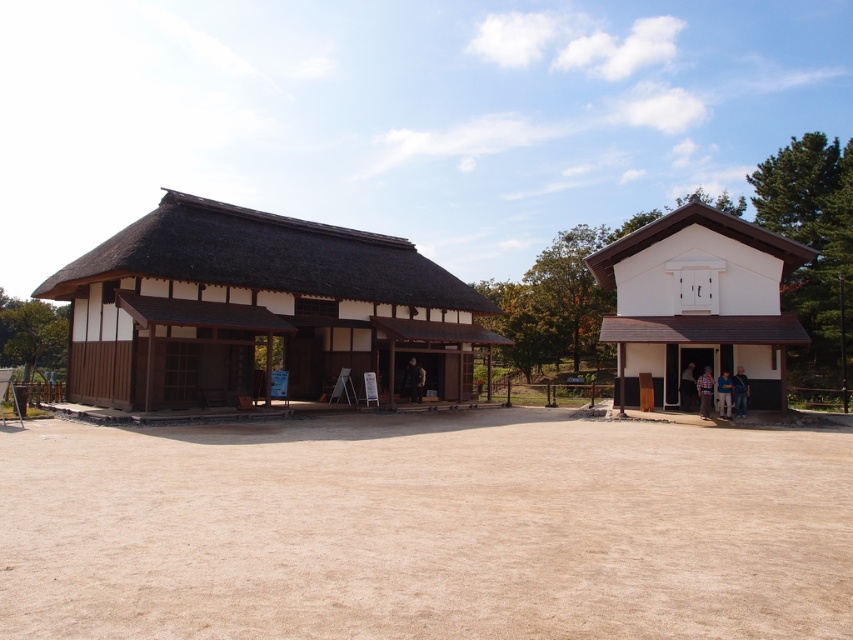
You are a tourist visiting the area and want to take a photo of both the wooden thatched roof hut at center and the white matte house at right. Which one should you stand closer to in order to capture both in the same frame?

You should stand closer to the white matte house at right because the wooden thatched roof hut at center is positioned over it, meaning it is farther away. By moving closer to the nearer object, you can include both in your photo.

You are standing at the entrance of the larger building on the left. You want to walk to the wooden thatched roof hut at center. Which direction should you walk to avoid the brown sandy dirt field at center?

The brown sandy dirt field at center is shorter than the wooden thatched roof hut at center. To avoid the field, walk towards the wooden thatched roof hut at center directly since the field is not blocking the path.